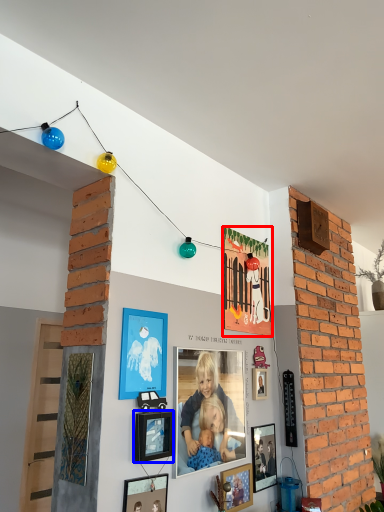
Question: Which point is further to the camera, picture frame (highlighted by a red box) or picture frame (highlighted by a blue box)?

Choices:
 (A) picture frame
 (B) picture frame

Answer: (A)